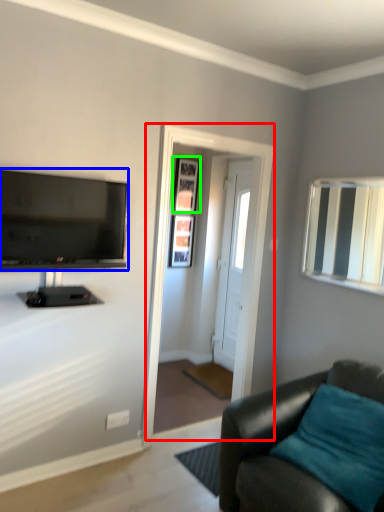
Question: Which object is the farthest from screen door (highlighted by a red box)? Choose among these: television (highlighted by a blue box) or picture frame (highlighted by a green box).

Choices:
 (A) television
 (B) picture frame

Answer: (B)